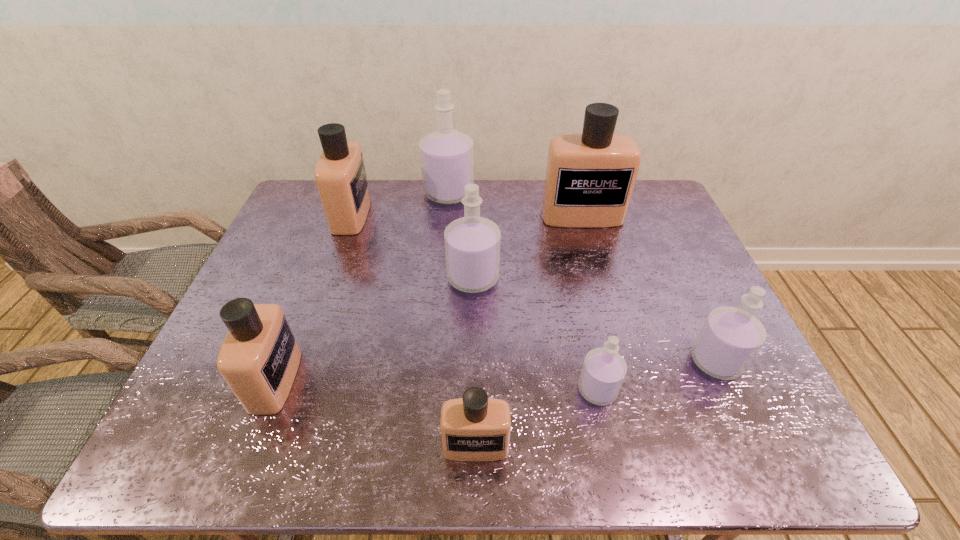
In order to click on the biggest purple perfume in this screenshot , I will do `click(446, 155)`.

You are a GUI agent. You are given a task and a screenshot of the screen. Output one action in this format:
    pyautogui.click(x=<x>, y=<y>)
    Task: Click on the rightmost beige perfume
    This screenshot has width=960, height=540.
    Given the screenshot: What is the action you would take?
    pyautogui.click(x=590, y=177)

The image size is (960, 540). What are the coordinates of `the third smallest beige perfume` in the screenshot? It's located at (340, 175).

Find the location of `the fifth nearest object`. the fifth nearest object is located at coordinates (472, 243).

Locate an element on the screen. This screenshot has height=540, width=960. the fifth nearest perfume is located at coordinates (472, 243).

Where is `the third biggest beige perfume`? The width and height of the screenshot is (960, 540). the third biggest beige perfume is located at coordinates (259, 358).

The width and height of the screenshot is (960, 540). I want to click on the rightmost purple perfume, so click(730, 338).

The image size is (960, 540). Identify the location of the third biggest purple perfume. (730, 338).

The width and height of the screenshot is (960, 540). Identify the location of the second purple perfume from right to left. (x=603, y=371).

Find the location of a particular element. the smallest beige perfume is located at coordinates (474, 428).